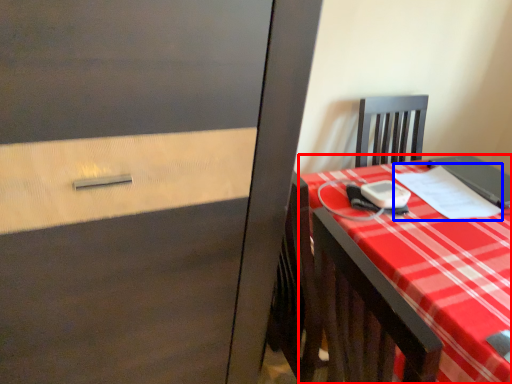
Question: Which object is closer to the camera taking this photo, desk (highlighted by a red box) or notebook (highlighted by a blue box)?

Choices:
 (A) desk
 (B) notebook

Answer: (A)